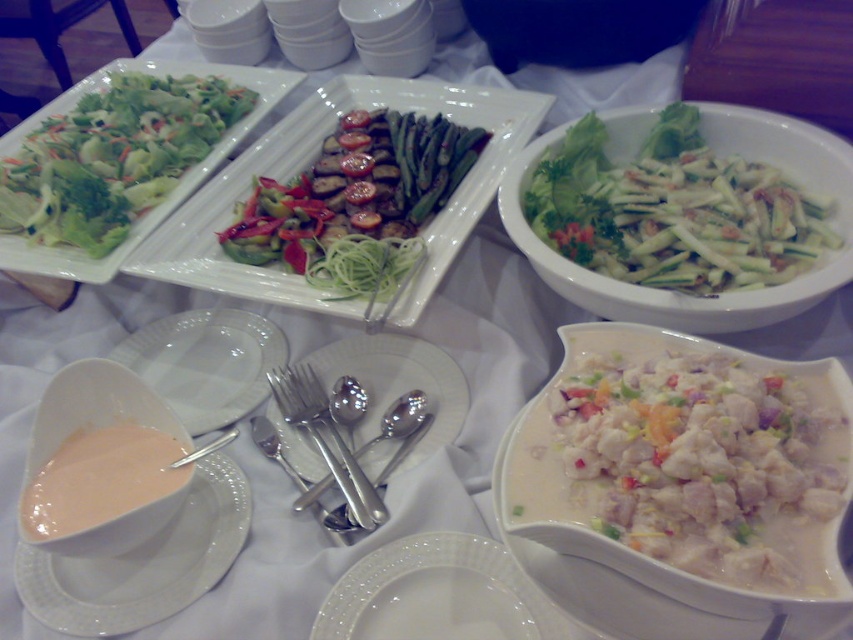
Question: Can you confirm if white creamy sauce at center is positioned to the left of green matte salad at center?

Choices:
 (A) no
 (B) yes

Answer: (A)

Question: Is pink matte bowl at lower left to the right of green leafy salad at upper left from the viewer's perspective?

Choices:
 (A) yes
 (B) no

Answer: (A)

Question: Which of the following is the closest to the observer?

Choices:
 (A) green leafy salad at upper left
 (B) white ceramic bowl at lower left
 (C) white creamy sauce at center
 (D) green matte salad at upper center

Answer: (C)

Question: Which point appears farthest from the camera in this image?

Choices:
 (A) (312, 468)
 (B) (38, 428)
 (C) (229, 349)

Answer: (C)

Question: Does green matte salad at center appear on the left side of pink matte bowl at lower left?

Choices:
 (A) no
 (B) yes

Answer: (A)

Question: Among these objects, which one is farthest from the camera?

Choices:
 (A) white glossy plate at center
 (B) silvermetallicforks/spoons at center
 (C) green leafy salad at upper left
 (D) white creamy sauce at center

Answer: (C)